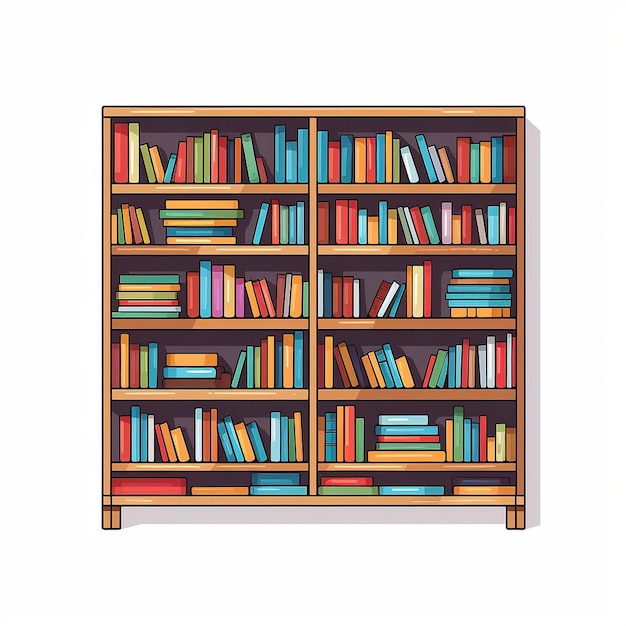
Where is `bottom shelf items`? The width and height of the screenshot is (626, 626). bottom shelf items is located at coordinates (148, 486), (217, 488), (277, 491), (270, 478), (340, 493), (347, 478), (393, 491), (488, 490), (476, 479).